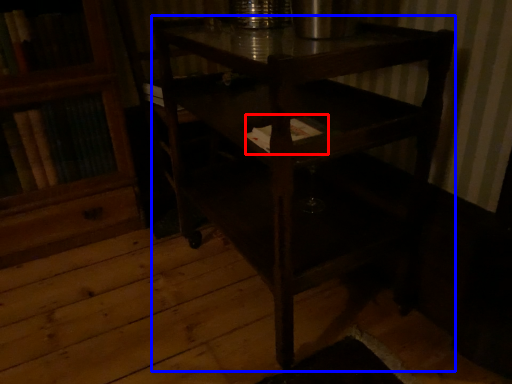
Question: Which object appears closest to the camera in this image, book (highlighted by a red box) or table (highlighted by a blue box)?

Choices:
 (A) book
 (B) table

Answer: (B)